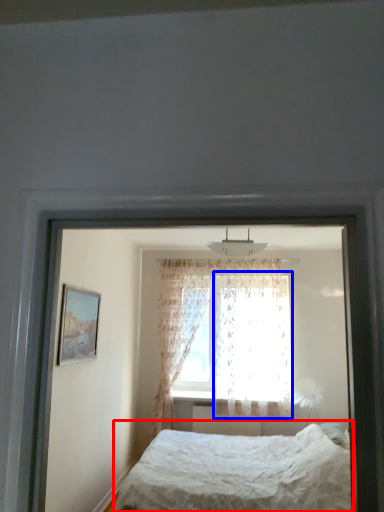
Question: Which object appears farthest to the camera in this image, bed (highlighted by a red box) or curtain (highlighted by a blue box)?

Choices:
 (A) bed
 (B) curtain

Answer: (B)